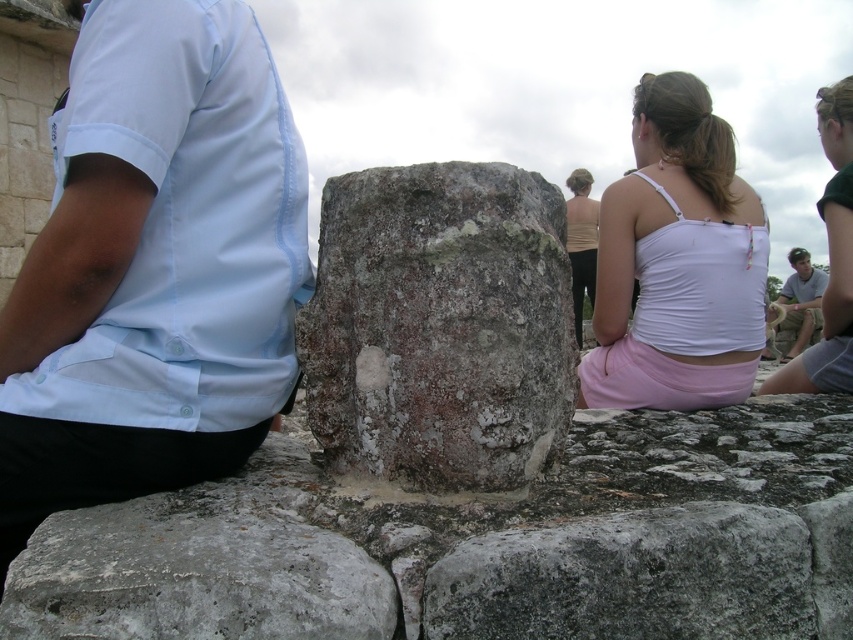
Question: Observing the image, what is the correct spatial positioning of rusty stone boulder at center in reference to gray rough stone at center?

Choices:
 (A) right
 (B) left

Answer: (A)

Question: Based on their relative distances, which object is farther from the light blue shirt at right?

Choices:
 (A) light gray stone statue at upper right
 (B) beige fabric top at center

Answer: (A)

Question: Which point is farther to the camera?

Choices:
 (A) (587, 252)
 (B) (798, 259)
 (C) (670, 180)

Answer: (B)

Question: Can you confirm if gray stone boulder at center is wider than light blue shirt at right?

Choices:
 (A) yes
 (B) no

Answer: (B)

Question: Which point appears closest to the camera in this image?

Choices:
 (A) (x=132, y=576)
 (B) (x=282, y=380)

Answer: (A)

Question: Is light blue cotton shirt at upper left above gray rough stone at center?

Choices:
 (A) yes
 (B) no

Answer: (A)